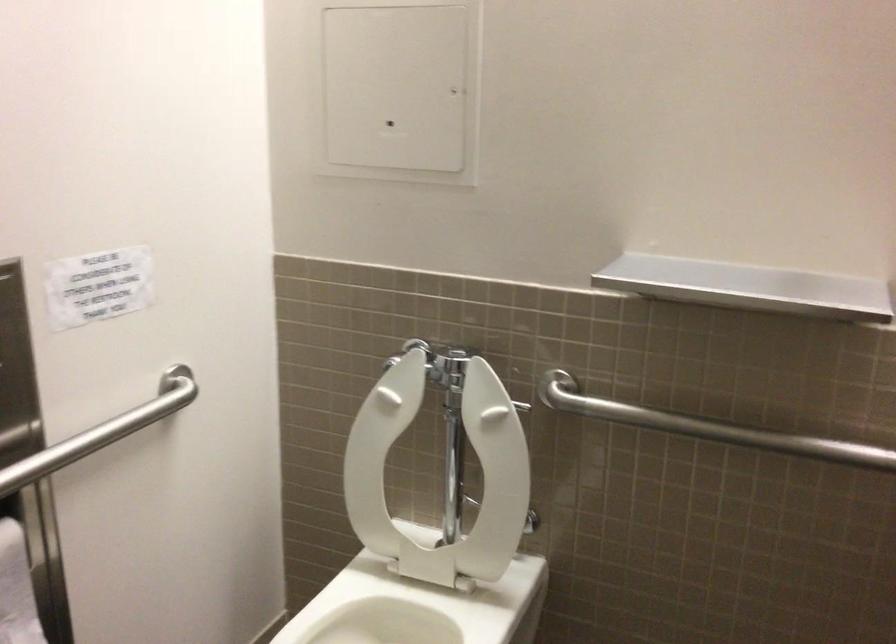
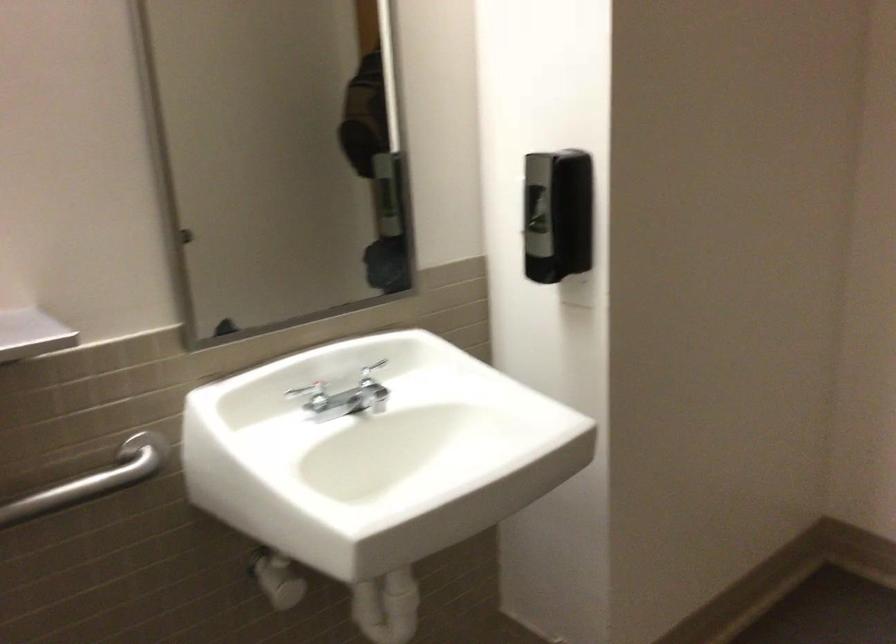
Question: How did the camera likely rotate?

Choices:
 (A) Left
 (B) Right
 (C) Up
 (D) Down

Answer: (B)